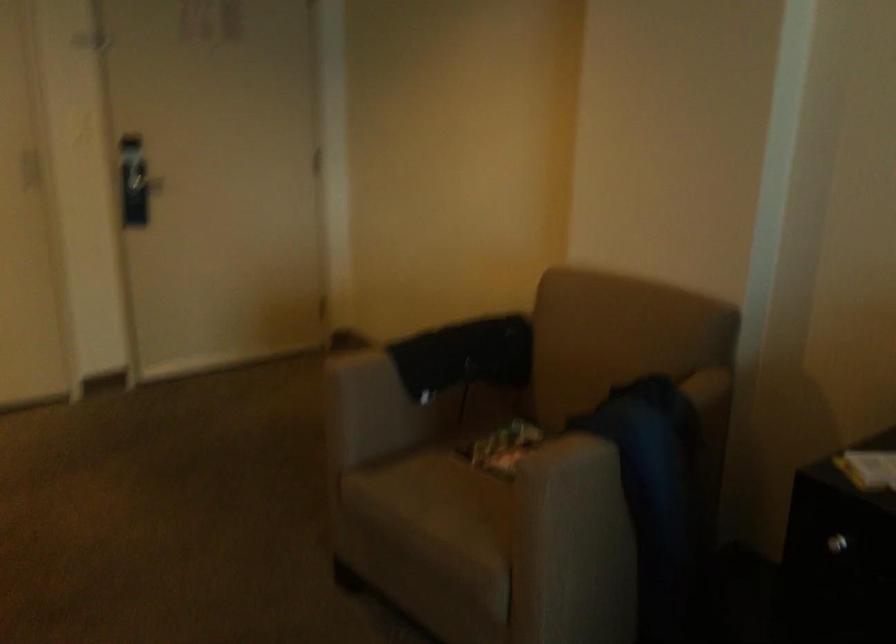
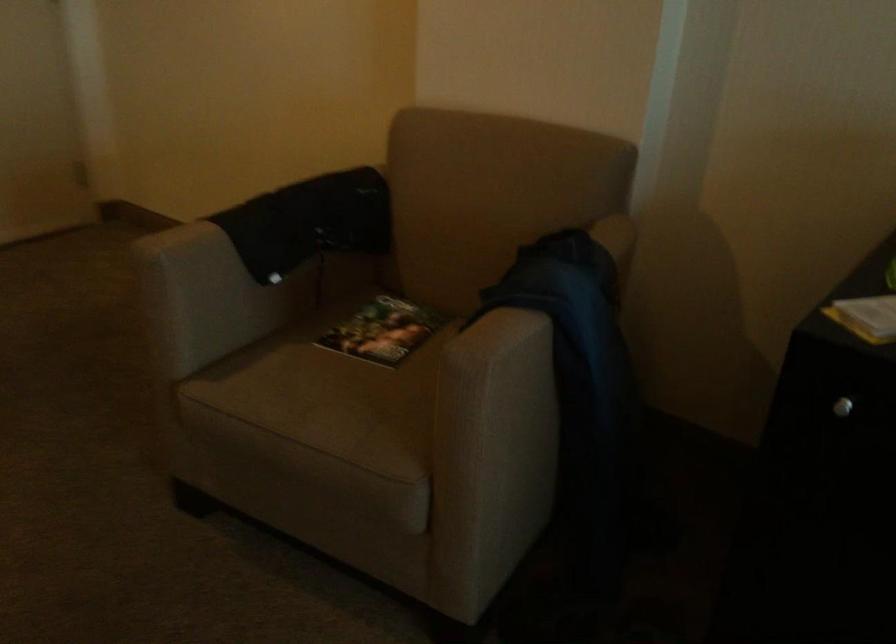
Find the pixel in the second image that matches point 643,402 in the first image.

(564, 261)